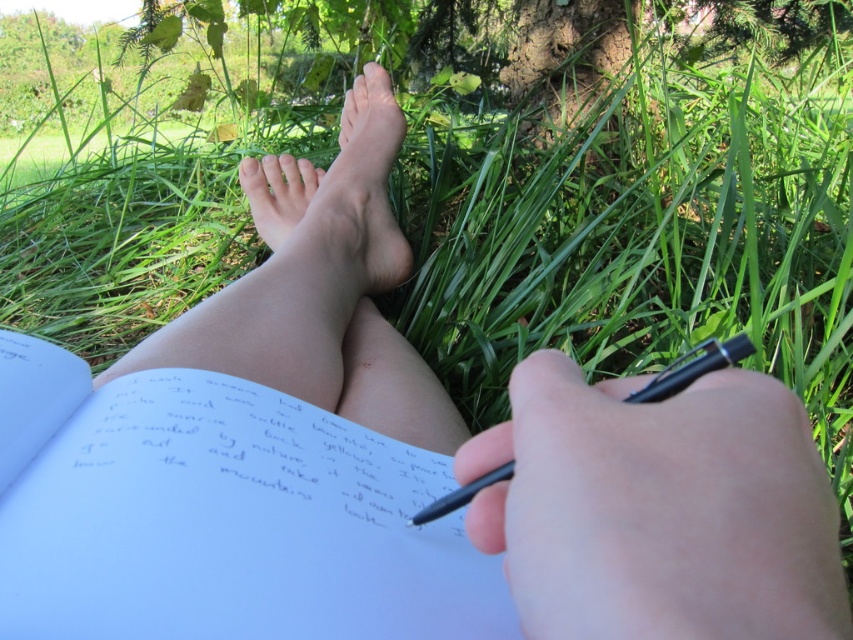
Between pale skin foot at center and black plastic pen at lower center, which one appears on the left side from the viewer's perspective?

Positioned to the left is pale skin foot at center.

Is pale skin foot at center behind black plastic pen at lower center?

Yes, pale skin foot at center is behind black plastic pen at lower center.

Between point (323, 205) and point (682, 358), which one is positioned in front?

Point (682, 358) is more forward.

Locate an element on the screen. The width and height of the screenshot is (853, 640). pale skin foot at center is located at coordinates (334, 204).

Is white paper journal at center below black plastic pen at lower center?

Correct, white paper journal at center is located below black plastic pen at lower center.

Does point (0, 456) come behind point (436, 506)?

Yes.

At what (x,y) coordinates should I click in order to perform the action: click on white paper journal at center. Please return your answer as a coordinate pair (x, y). This screenshot has width=853, height=640. Looking at the image, I should click on (218, 515).

At what (x,y) coordinates should I click in order to perform the action: click on white paper journal at center. Please return your answer as a coordinate pair (x, y). This screenshot has width=853, height=640. Looking at the image, I should click on (218, 515).

Does white paper journal at center appear over pale skin foot at center?

No.

This screenshot has height=640, width=853. In order to click on white paper journal at center in this screenshot , I will do `click(218, 515)`.